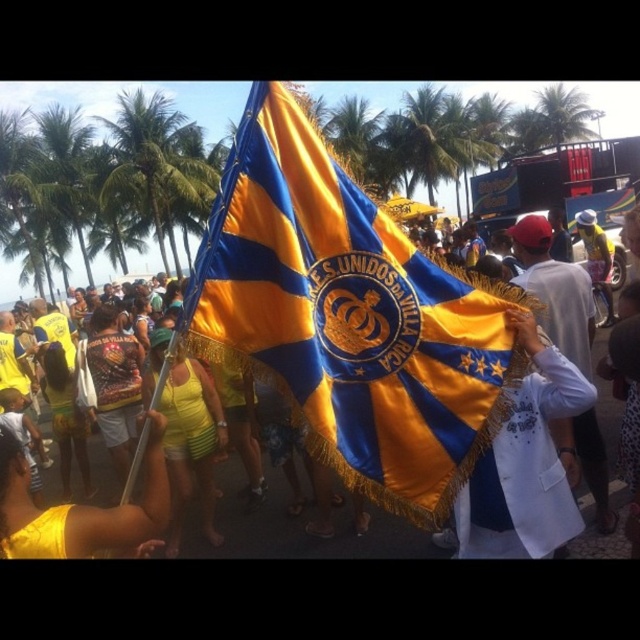
You are a photographer trying to capture the flag in the center of your photo. You notice the green leafy palm tree at upper left and the white cotton shirt at center are blocking your view. Which object is wider and might be causing more obstruction?

The green leafy palm tree at upper left might be wider than the white cotton shirt at center, so it could be causing more obstruction in your view.